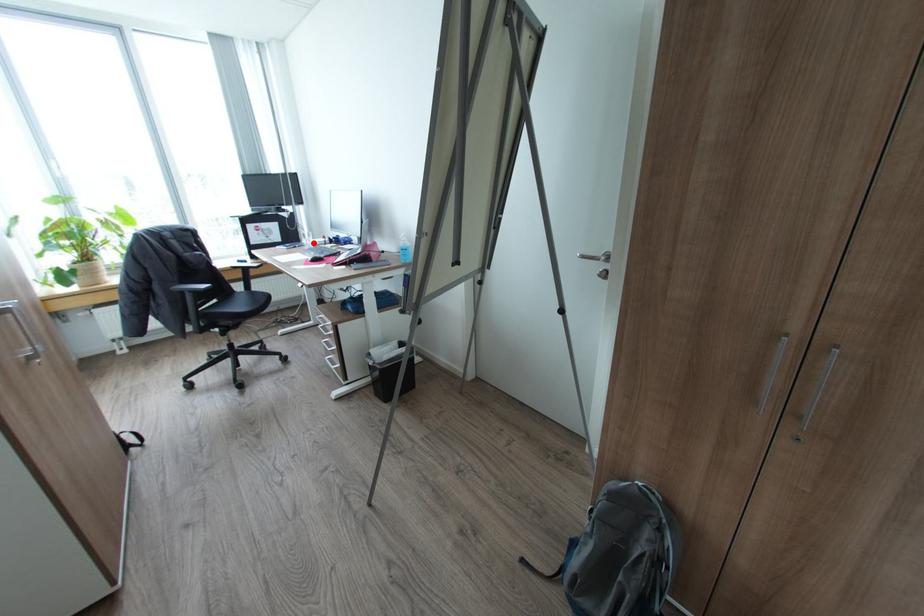
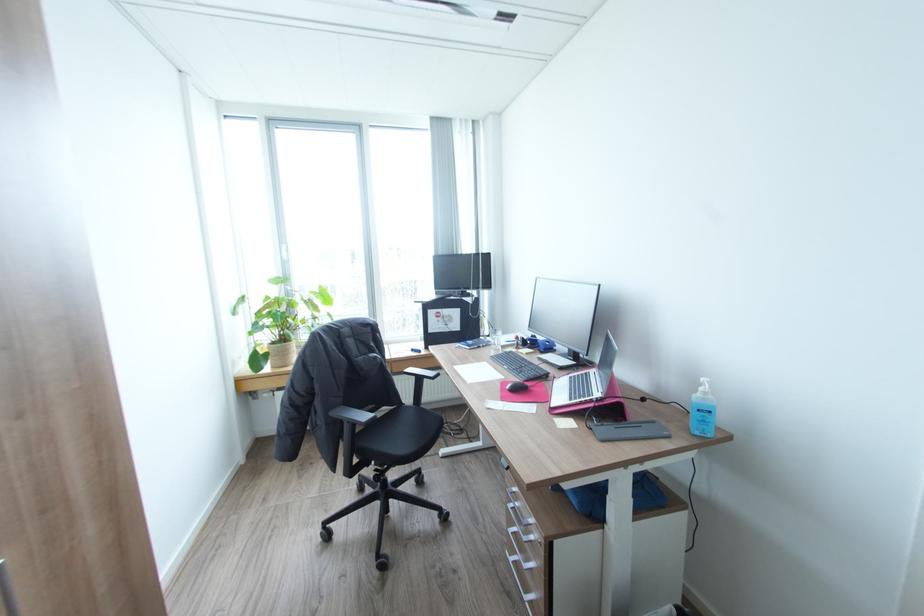
Where in the second image is the point corresponding to the highlighted location from the first image?

(502, 344)